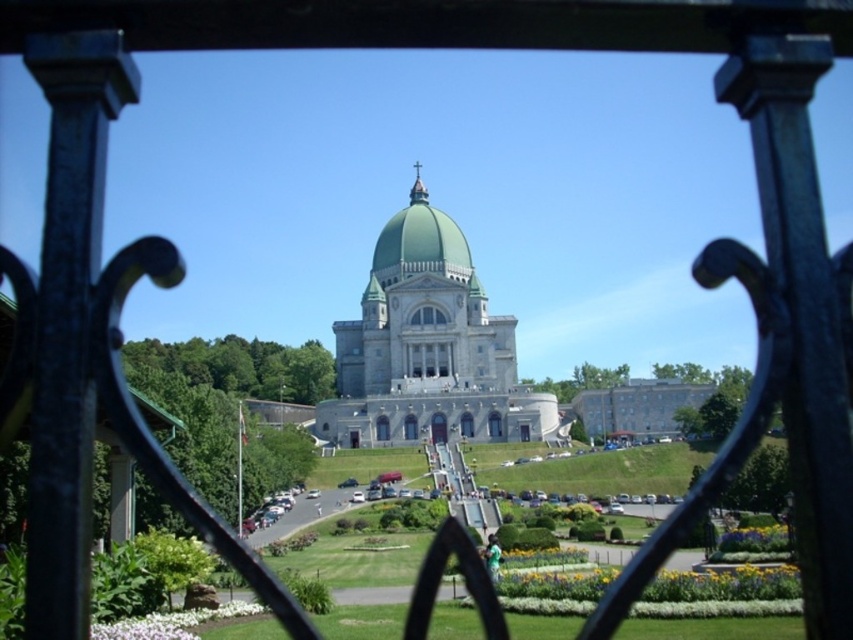
You are standing at the base of the staircase leading to the entrance of the green marble palace at center. Looking up, you notice the green matte dome at center above you. Which object is positioned higher in the scene?

The green matte dome at center is positioned higher than the green marble palace at center because it is located above it.

You are standing at the point marked as point (428, 348) in the image. What is the name of the structure directly in front of you?

The structure directly in front of you at point (428, 348) is the green marble palace at center.

You are a tour guide explaining the architectural features of the scene. You want to highlight the relative sizes of the green marble palace at center and the green matte dome at center. Which one is wider?

The green marble palace at center is wider than the green matte dome at center.